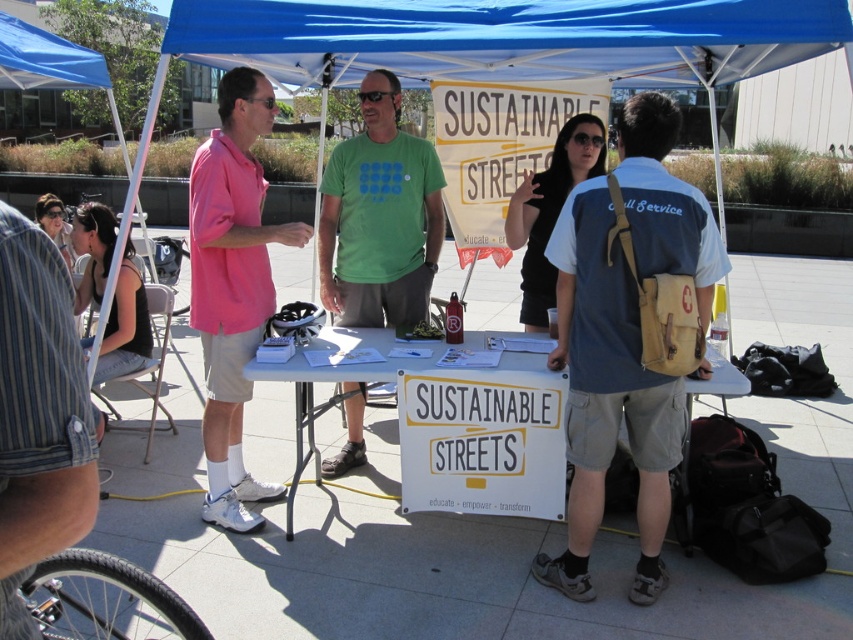
Is point (566, 321) closer to viewer compared to point (434, 225)?

That is True.

Does tan canvas backpack at center lie in front of green fabric shirt at center?

Yes, tan canvas backpack at center is closer to the viewer.

Is point (596, 380) positioned behind point (373, 99)?

That is False.

Locate an element on the screen. tan canvas backpack at center is located at coordinates (624, 339).

Looking at this image, who is positioned more to the left, pink cotton shirt at left or black fabric tank top at left?

black fabric tank top at left is more to the left.

Is point (248, 476) positioned before point (140, 310)?

Yes, it is in front of point (140, 310).

Locate an element on the screen. Image resolution: width=853 pixels, height=640 pixels. pink cotton shirt at left is located at coordinates (231, 285).

Identify the location of pink cotton shirt at left. (231, 285).

Does point (299, 353) come closer to viewer compared to point (123, 259)?

Yes.

Is white paperboard sign at center above black fabric tank top at left?

No.

Where is `white paperboard sign at center`? The height and width of the screenshot is (640, 853). white paperboard sign at center is located at coordinates (444, 426).